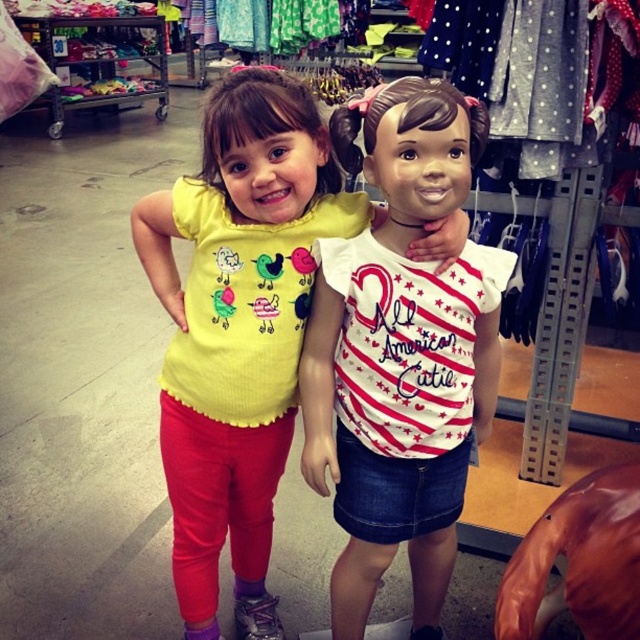
Question: Which of the following is the closest to the observer?

Choices:
 (A) white matte shirt at center
 (B) yellow matte shirt at center

Answer: (A)

Question: Which point is closer to the camera?

Choices:
 (A) (412, 188)
 (B) (250, 292)

Answer: (A)

Question: Is yellow matte shirt at center to the left of white matte shirt at center from the viewer's perspective?

Choices:
 (A) no
 (B) yes

Answer: (B)

Question: Can you confirm if yellow matte shirt at center is positioned above white matte shirt at center?

Choices:
 (A) no
 (B) yes

Answer: (B)

Question: Does yellow matte shirt at center appear under white matte shirt at center?

Choices:
 (A) no
 (B) yes

Answer: (A)

Question: Which point is closer to the camera?

Choices:
 (A) yellow matte shirt at center
 (B) white matte shirt at center

Answer: (B)